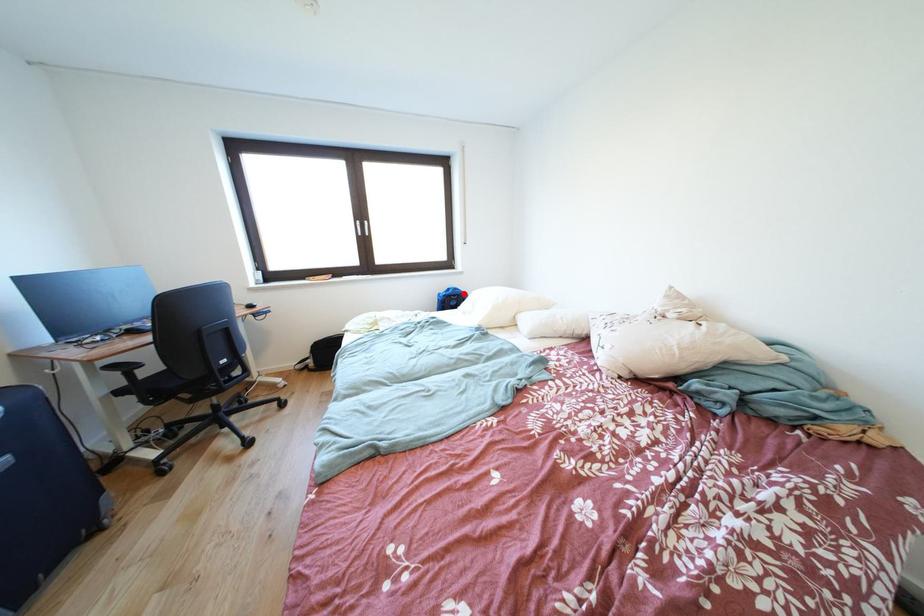
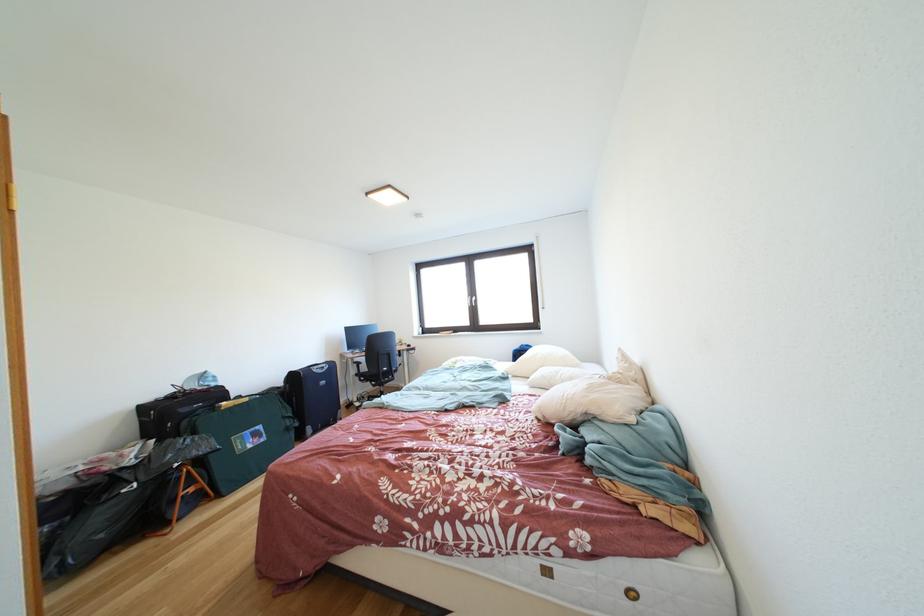
Find the pixel in the second image that matches the highlighted location in the first image.

(535, 351)